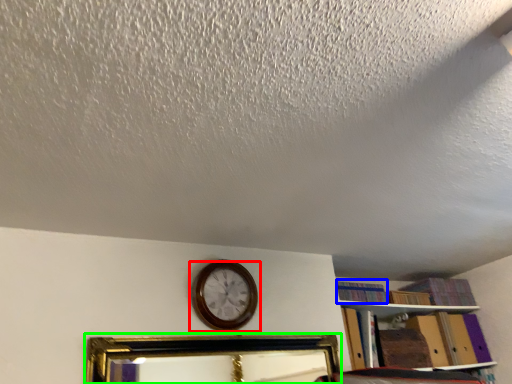
Question: Which object is positioned closest to wall clock (highlighted by a red box)? Select from book (highlighted by a blue box) and picture frame (highlighted by a green box).

Choices:
 (A) book
 (B) picture frame

Answer: (A)